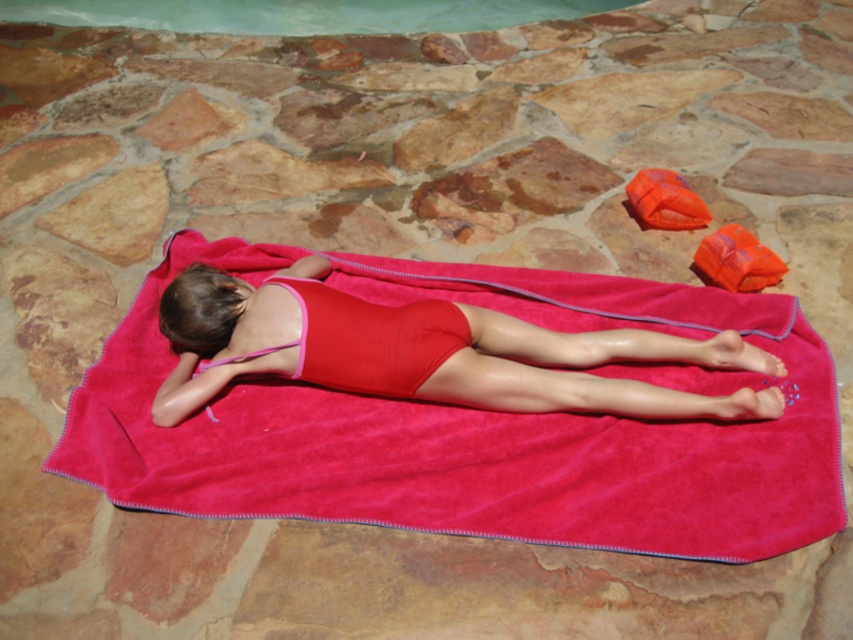
Who is positioned more to the right, matte pink towel at center or matte red swimsuit at center?

matte red swimsuit at center is more to the right.

Is point (300, 387) positioned behind point (270, 332)?

That is True.

Locate an element on the screen. Image resolution: width=853 pixels, height=640 pixels. matte pink towel at center is located at coordinates (476, 424).

What are the coordinates of `matte pink towel at center` in the screenshot? It's located at (476, 424).

Is matte pink towel at center smaller than clear glass pool at upper center?

No, matte pink towel at center is not smaller than clear glass pool at upper center.

Between matte pink towel at center and clear glass pool at upper center, which one is positioned lower?

matte pink towel at center is below.

What do you see at coordinates (476, 424) in the screenshot? The width and height of the screenshot is (853, 640). I see `matte pink towel at center` at bounding box center [476, 424].

This screenshot has width=853, height=640. In order to click on matte pink towel at center in this screenshot , I will do `click(476, 424)`.

Does matte red swimsuit at center have a greater height compared to clear glass pool at upper center?

Yes, matte red swimsuit at center is taller than clear glass pool at upper center.

The image size is (853, 640). What do you see at coordinates (581, 371) in the screenshot? I see `matte red swimsuit at center` at bounding box center [581, 371].

Between point (712, 349) and point (349, 19), which one is positioned in front?

Point (712, 349) is more forward.

Where is `matte red swimsuit at center`? matte red swimsuit at center is located at coordinates (581, 371).